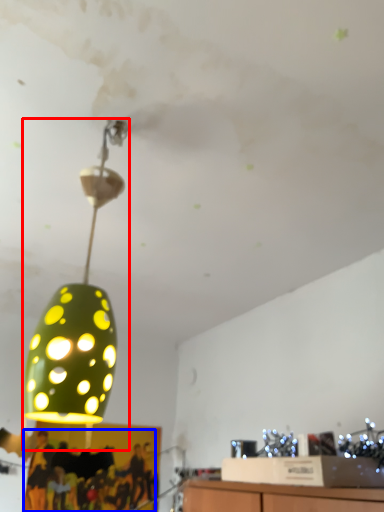
Question: Which of the following is the closest to the observer, lamp (highlighted by a red box) or person (highlighted by a blue box)?

Choices:
 (A) lamp
 (B) person

Answer: (A)